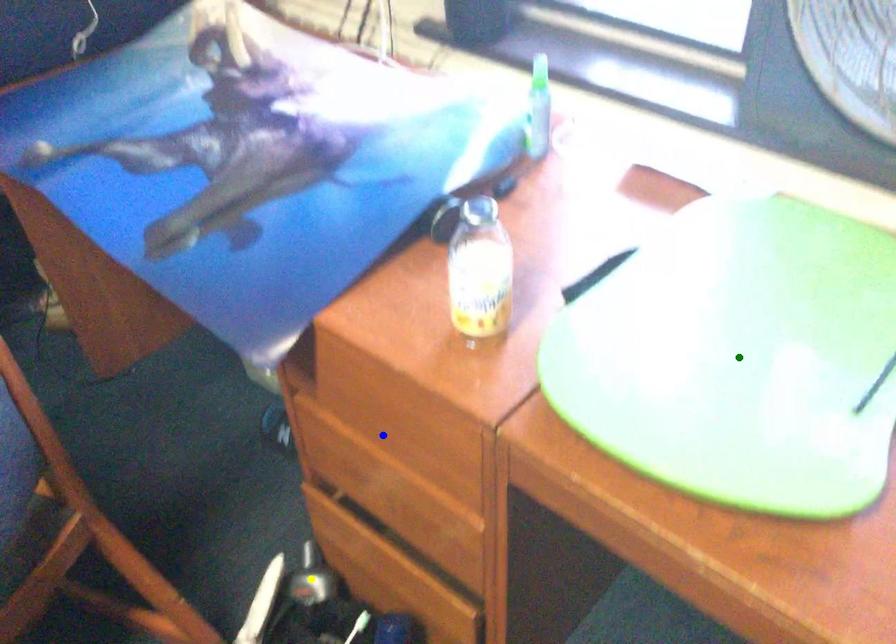
Order these from nearest to farthest:
yellow point, blue point, green point

1. yellow point
2. blue point
3. green point